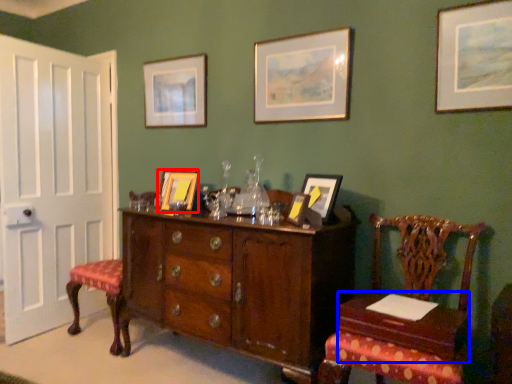
Question: Which object is further to the camera taking this photo, picture frame (highlighted by a red box) or table (highlighted by a blue box)?

Choices:
 (A) picture frame
 (B) table

Answer: (A)